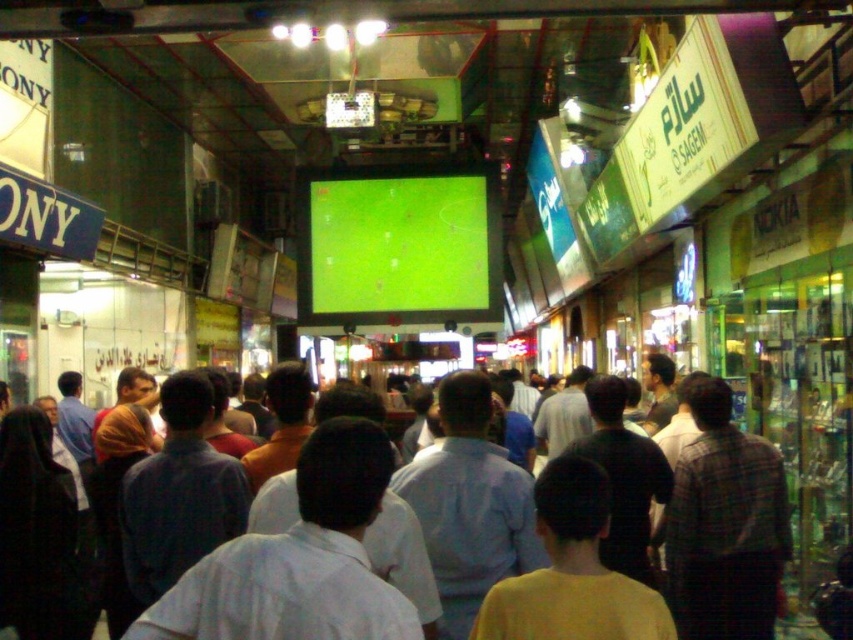
Question: Does green matte screen at center appear on the right side of light blue shirt at center?

Choices:
 (A) yes
 (B) no

Answer: (B)

Question: Is green matte screen at center above light blue shirt at center?

Choices:
 (A) no
 (B) yes

Answer: (B)

Question: Is the position of green matte screen at center less distant than that of light blue shirt at center?

Choices:
 (A) yes
 (B) no

Answer: (B)

Question: Which object is farther from the camera taking this photo?

Choices:
 (A) green matte screen at center
 (B) light blue shirt at center

Answer: (A)

Question: Which of the following is the closest to the observer?

Choices:
 (A) (457, 227)
 (B) (579, 392)

Answer: (B)

Question: Which point is farther from the camera taking this photo?

Choices:
 (A) (363, 202)
 (B) (223, 417)

Answer: (A)